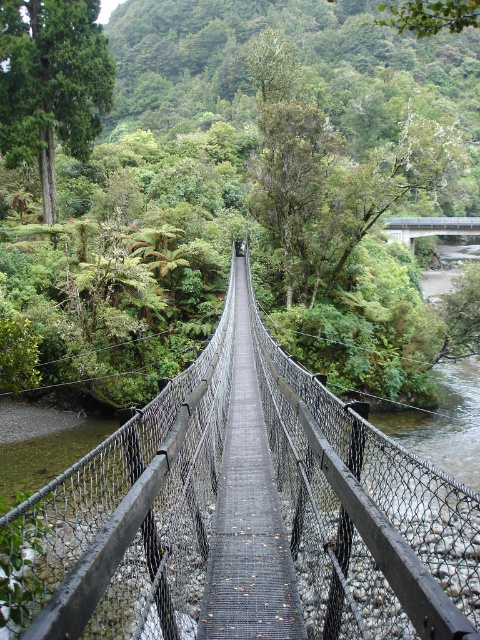
Does wooden mesh bridge at center have a lesser height compared to metallic gray bridge at center?

Indeed, wooden mesh bridge at center has a lesser height compared to metallic gray bridge at center.

Is wooden mesh bridge at center smaller than metallic gray bridge at center?

Yes.

Measure the distance between wooden mesh bridge at center and camera.

wooden mesh bridge at center and camera are 4.28 feet apart.

Where is `wooden mesh bridge at center`? wooden mesh bridge at center is located at coordinates (212, 508).